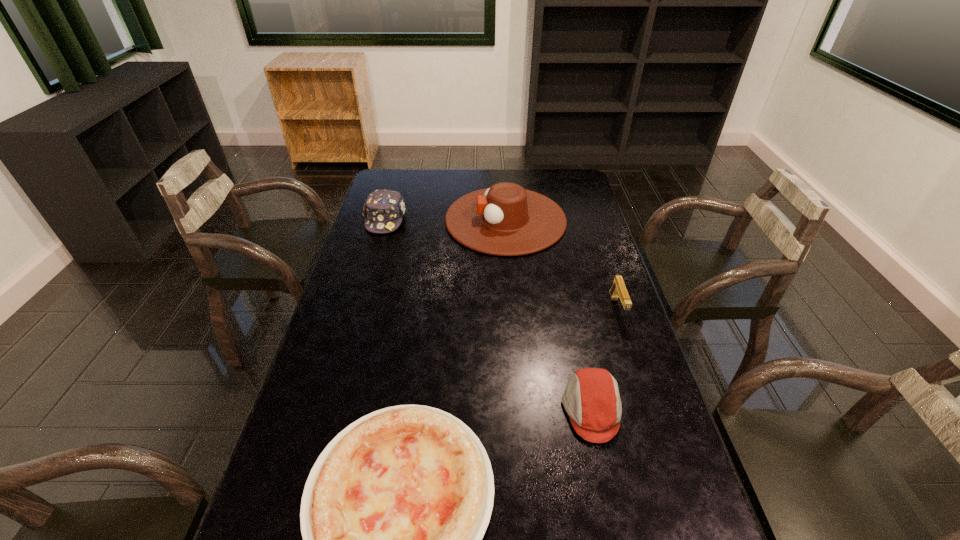
You are a GUI agent. You are given a task and a screenshot of the screen. Output one action in this format:
    pyautogui.click(x=<x>, y=<y>)
    Task: Click on the object that can be found as the third closest to the shortest object
    
    Given the screenshot: What is the action you would take?
    pos(506,220)

Locate an element on the screen. This screenshot has height=540, width=960. vacant position in the image that satisfies the following two spatial constraints: 1. at the barrel of the pistol; 2. on the front-facing side of the nearer cap is located at coordinates (650, 409).

Where is `free spot that satisfies the following two spatial constraints: 1. at the barrel of the third nearest object; 2. on the front-facing side of the nearer cap`? This screenshot has width=960, height=540. free spot that satisfies the following two spatial constraints: 1. at the barrel of the third nearest object; 2. on the front-facing side of the nearer cap is located at coordinates (650, 409).